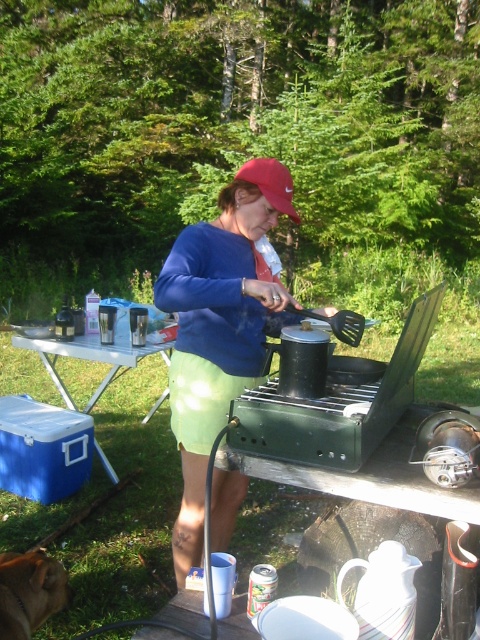
Question: Does white plastic picnic table at lower left have a larger size compared to red matte baseball cap at center?

Choices:
 (A) yes
 (B) no

Answer: (A)

Question: Among these objects, which one is nearest to the camera?

Choices:
 (A) red matte baseball cap at center
 (B) brown fur dog at lower left

Answer: (B)

Question: Which point appears closest to the camera in this image?

Choices:
 (A) (34, 592)
 (B) (282, 189)
 (C) (85, 358)
 (D) (163, 300)

Answer: (A)

Question: Estimate the real-world distances between objects in this image. Which object is farther from the white plastic picnic table at lower left?

Choices:
 (A) brown fur dog at lower left
 (B) blue fabric shirt at center
 (C) red matte baseball cap at center

Answer: (C)

Question: Does blue fabric shirt at center have a greater width compared to red matte baseball cap at center?

Choices:
 (A) no
 (B) yes

Answer: (B)

Question: Observing the image, what is the correct spatial positioning of blue fabric shirt at center in reference to brown fur dog at lower left?

Choices:
 (A) below
 (B) above

Answer: (B)